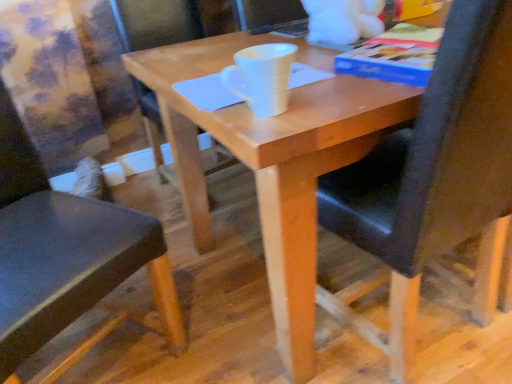
Locate an element on the screen. free space that is in between white matte mug at center and blue paper at upper right is located at coordinates (340, 92).